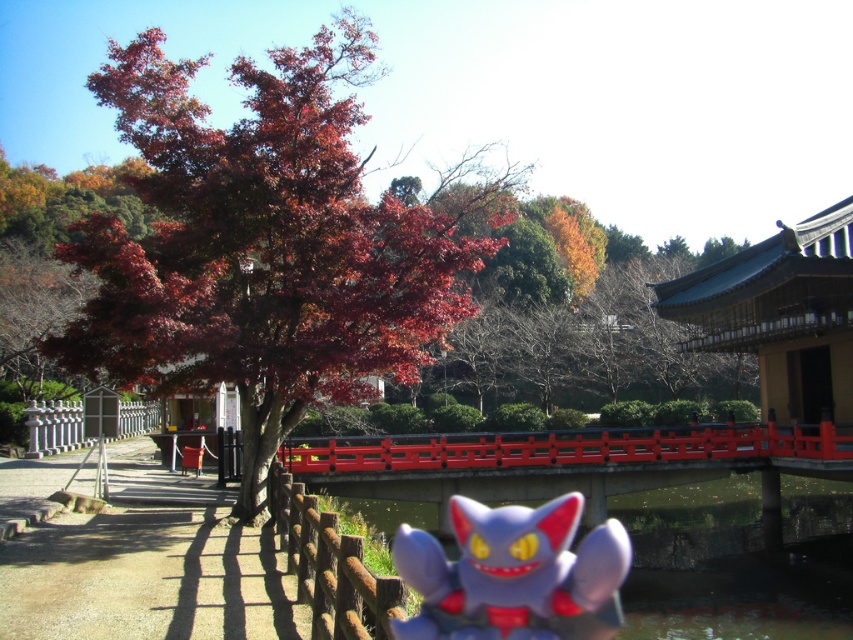
Who is positioned more to the right, shiny red maple tree at upper left or plush gray toy at center?

From the viewer's perspective, plush gray toy at center appears more on the right side.

Between shiny red maple tree at upper left and plush gray toy at center, which one has more height?

shiny red maple tree at upper left

Does point (210, 161) lie in front of point (527, 604)?

Yes.

The image size is (853, 640). In order to click on shiny red maple tree at upper left in this screenshot , I will do `click(270, 243)`.

Does shiny red maple tree at upper left appear under smooth red bridge at center?

No, shiny red maple tree at upper left is not below smooth red bridge at center.

What are the coordinates of `shiny red maple tree at upper left` in the screenshot? It's located at (270, 243).

Which is below, plush gray toy at center or brown wooden fence at lower center?

Positioned lower is plush gray toy at center.

Is point (602, 554) closer to viewer compared to point (387, 582)?

No, it is behind (387, 582).

Where is `plush gray toy at center`? plush gray toy at center is located at coordinates (514, 573).